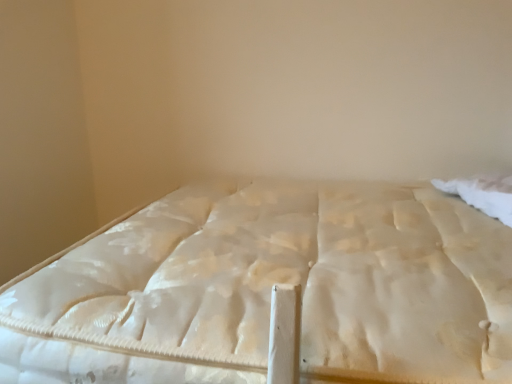
You are a GUI agent. You are given a task and a screenshot of the screen. Output one action in this format:
    pyautogui.click(x=<x>, y=<y>)
    Task: Click on the white fabric bed at center
    Image resolution: width=512 pixels, height=384 pixels.
    Given the screenshot: What is the action you would take?
    pyautogui.click(x=270, y=289)

What do you see at coordinates (270, 289) in the screenshot?
I see `white fabric bed at center` at bounding box center [270, 289].

This screenshot has height=384, width=512. In order to click on white fabric bed at center in this screenshot , I will do `click(270, 289)`.